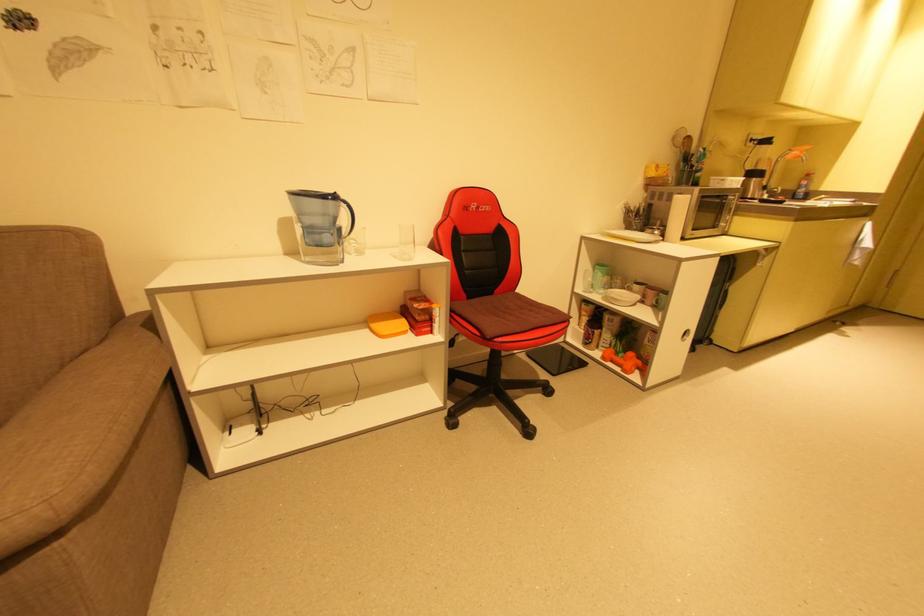
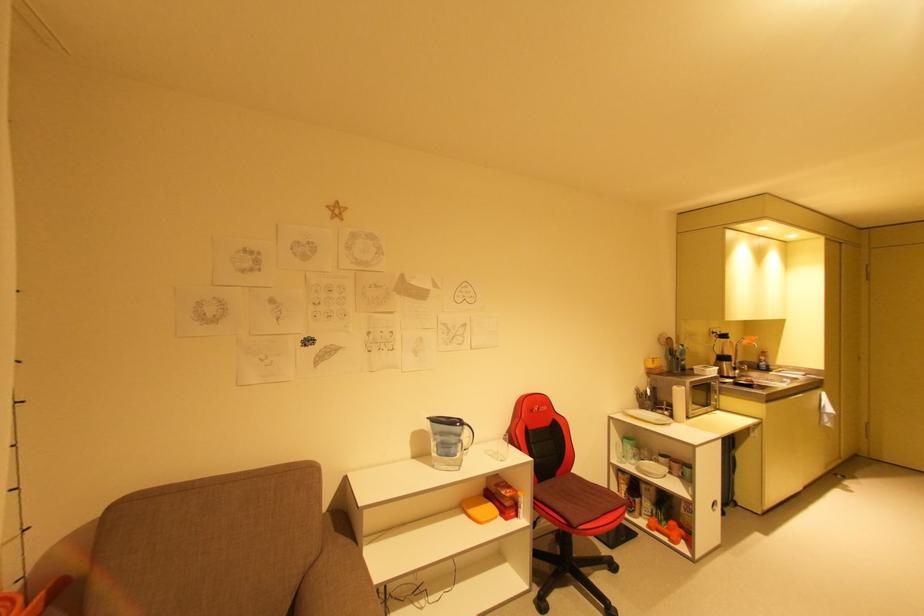
Locate, in the second image, the point that corresponds to [805,152] in the first image.

(756, 341)